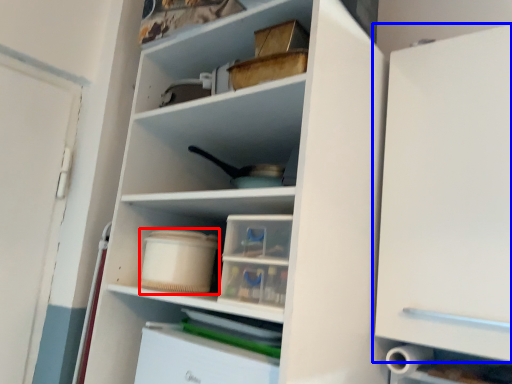
Question: Which point is further to the camera, storage box (highlighted by a red box) or cabinetry (highlighted by a blue box)?

Choices:
 (A) storage box
 (B) cabinetry

Answer: (A)